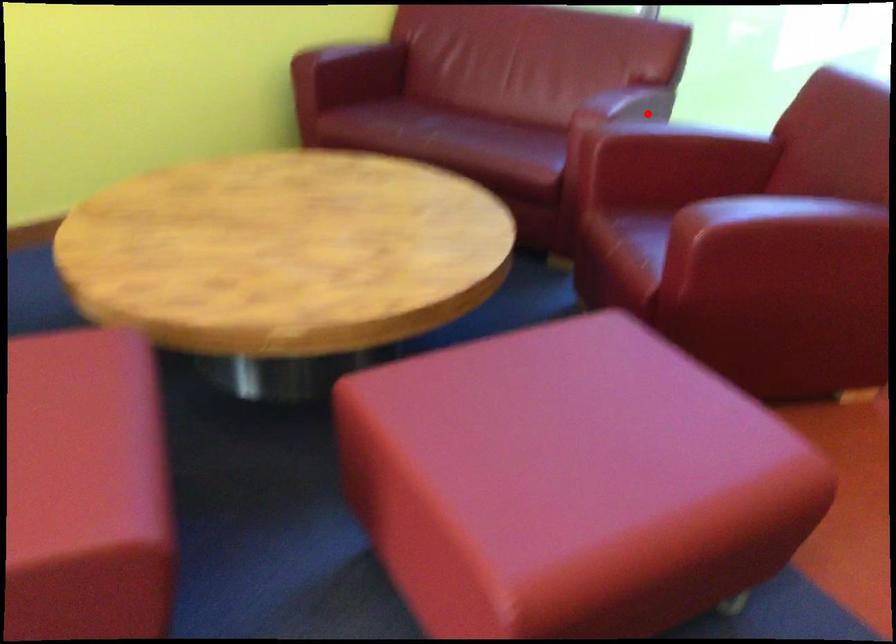
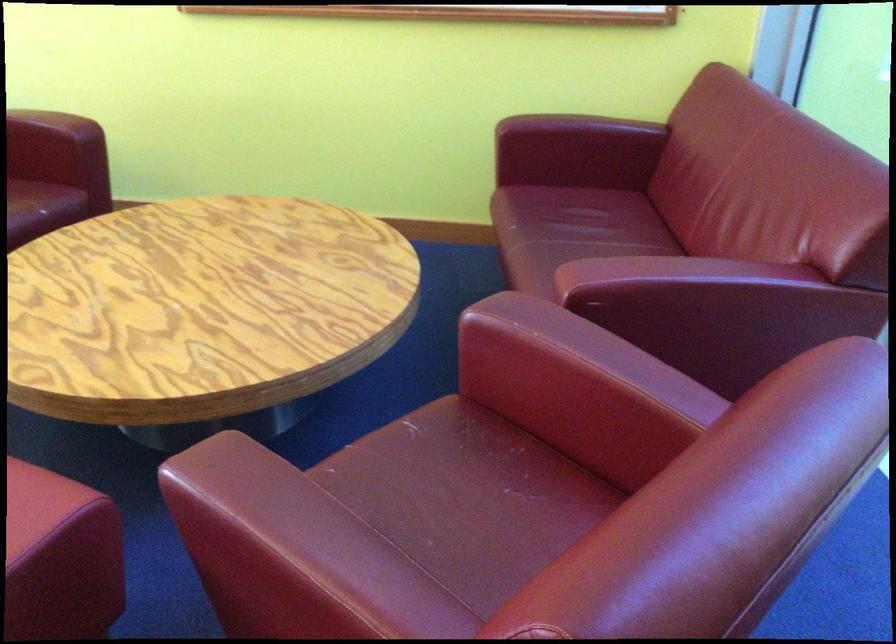
Question: I am providing you with two images of the same scene from different viewpoints. Given a red point in image1, look at the same physical point in image2. Is it:

Choices:
 (A) Closer to the viewpoint
 (B) Farther from the viewpoint

Answer: (A)